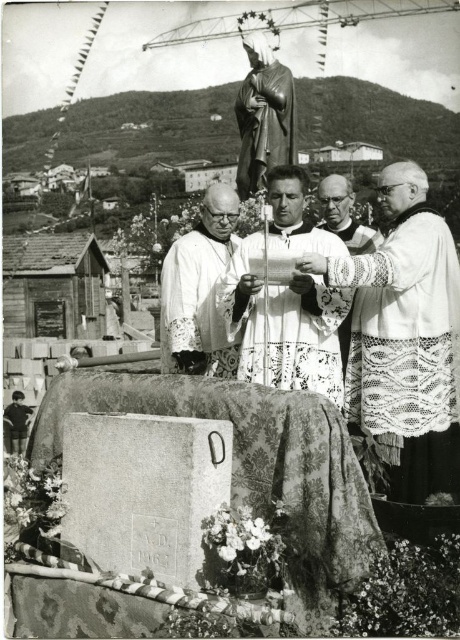
Question: Which object is positioned closest to the white lace robe at center?

Choices:
 (A) white lace vestment at right
 (B) shiny gold statue at center
 (C) white lace fabric at center

Answer: (A)

Question: Which object is positioned farthest from the white lace fabric at center?

Choices:
 (A) shiny gold statue at center
 (B) white lace robe at center
 (C) white lace vestment at right

Answer: (A)

Question: Does white lace vestment at right appear on the left side of shiny gold statue at center?

Choices:
 (A) no
 (B) yes

Answer: (A)

Question: Which object appears closest to the camera in this image?

Choices:
 (A) white lace robe at right
 (B) white lace vestment at right
 (C) white lace robe at center
 (D) white lace fabric at center

Answer: (B)

Question: Does white lace vestment at right appear under white lace fabric at center?

Choices:
 (A) no
 (B) yes

Answer: (B)

Question: Is white lace fabric at center closer to the viewer compared to white lace robe at right?

Choices:
 (A) no
 (B) yes

Answer: (A)